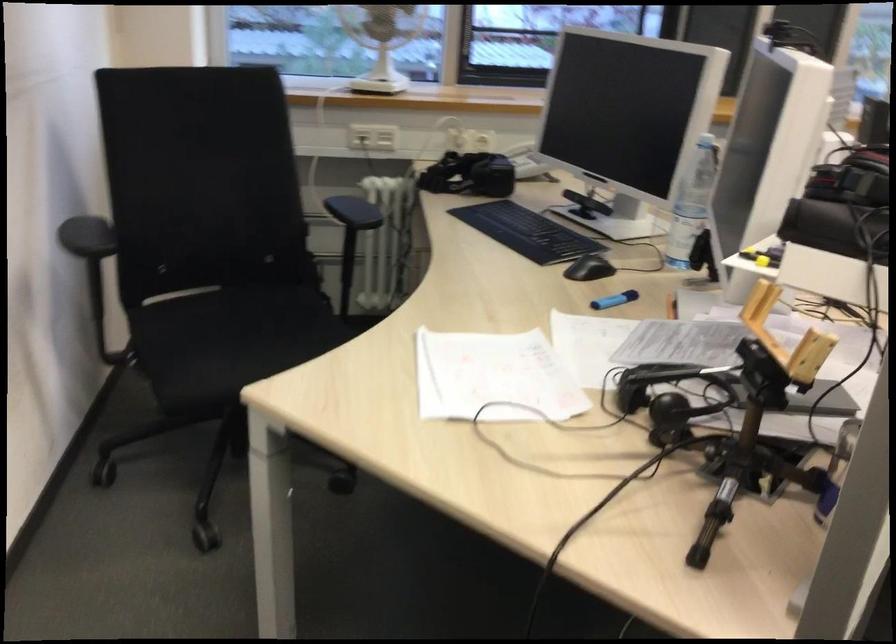
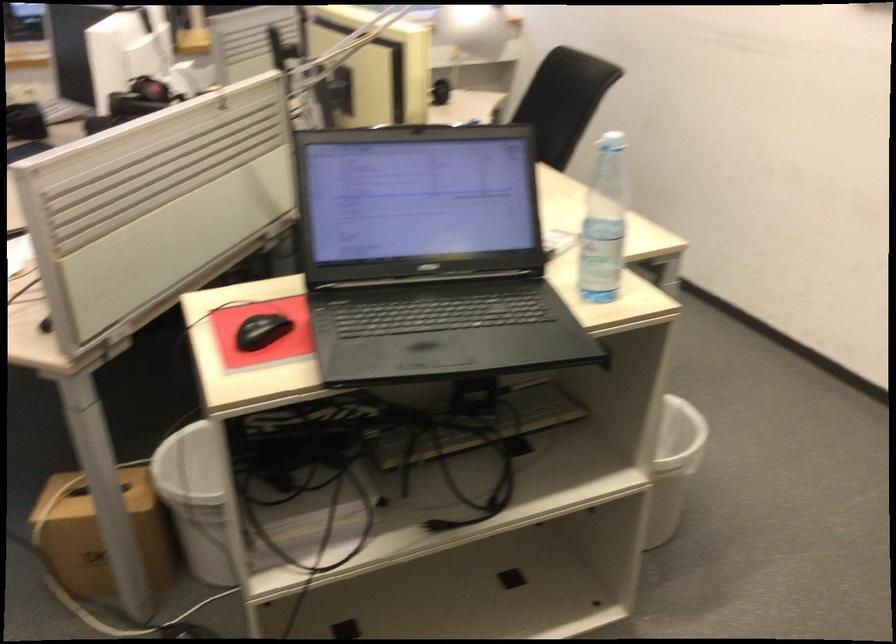
Question: I am providing you with two images of the same scene from different viewpoints. Which of the following objects are not visible in image2?

Choices:
 (A) black computer mouse
 (B) black headset
 (C) white mattress tag
 (D) brown cardboard box

Answer: (B)